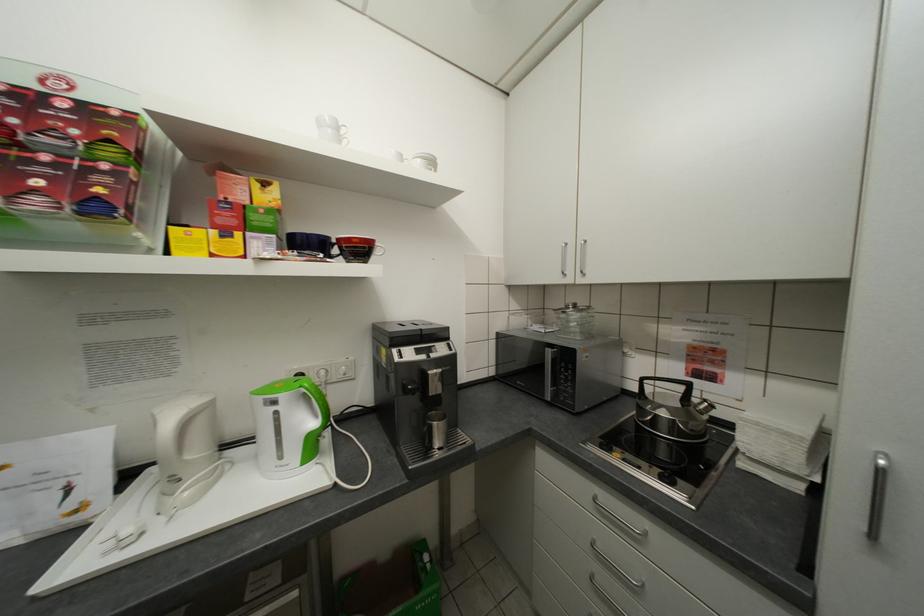
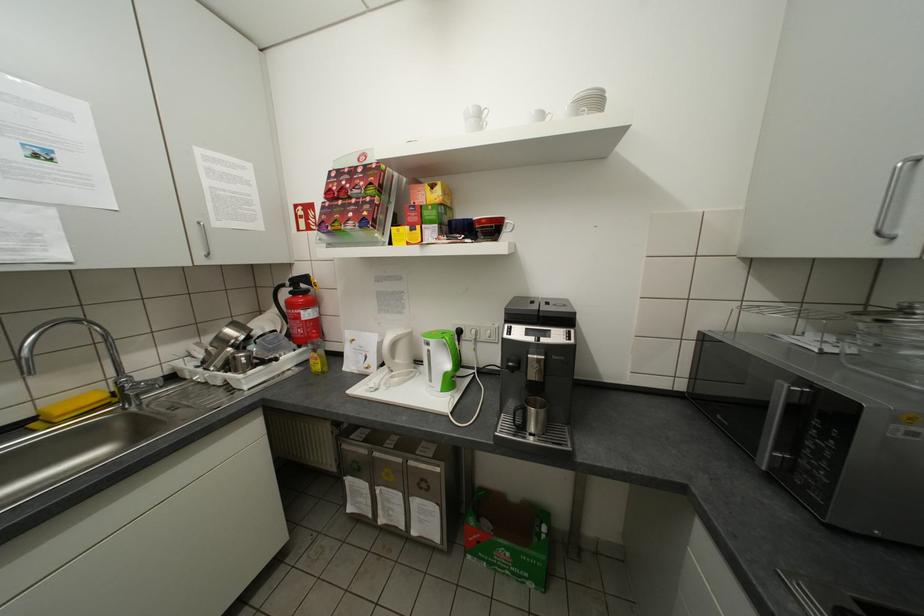
Find the pixel in the second image that matches point 409,158 in the first image.

(551, 116)